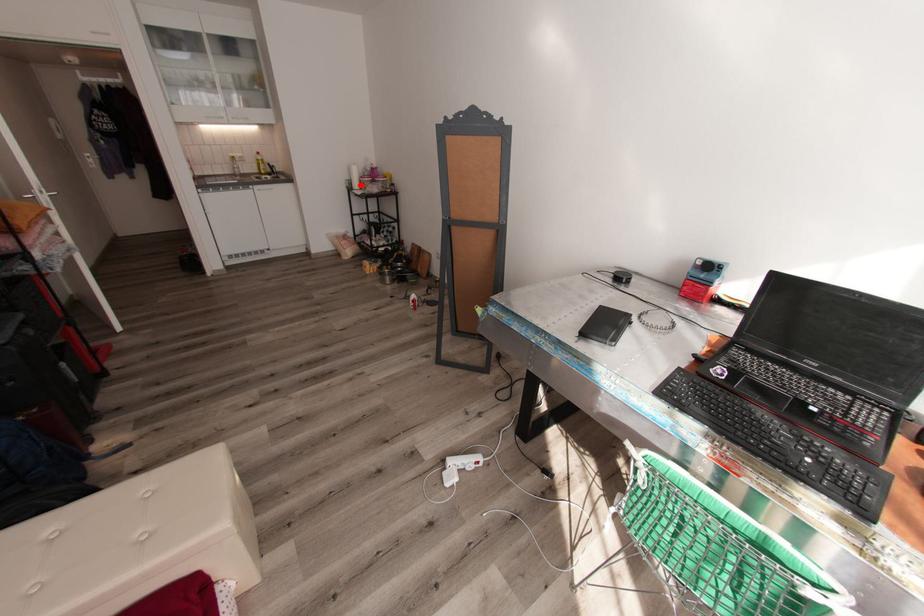
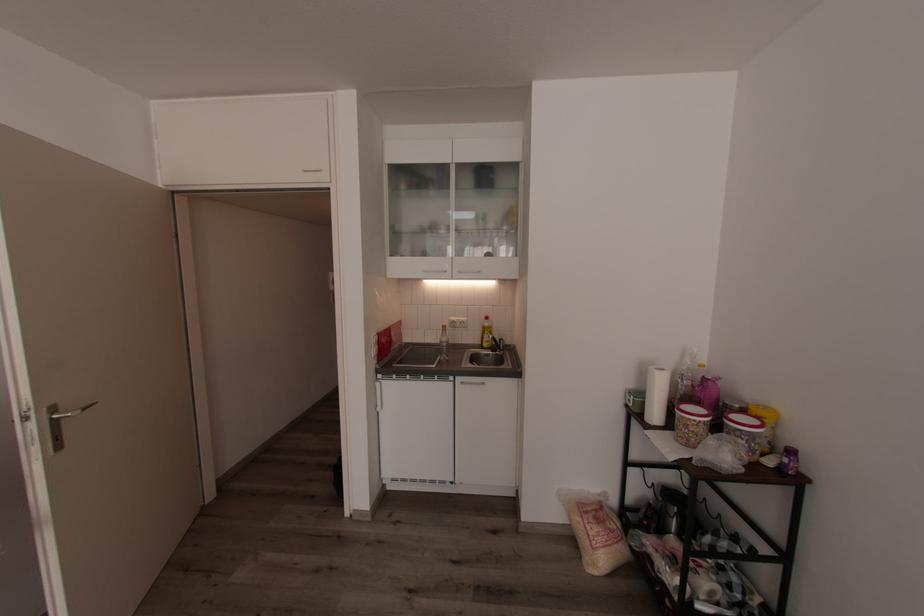
Question: I am providing you with two images of the same scene from different viewpoints. A red point is marked on the first image. Can you still see the location of the red point in image 2?

Choices:
 (A) Yes
 (B) No

Answer: (A)